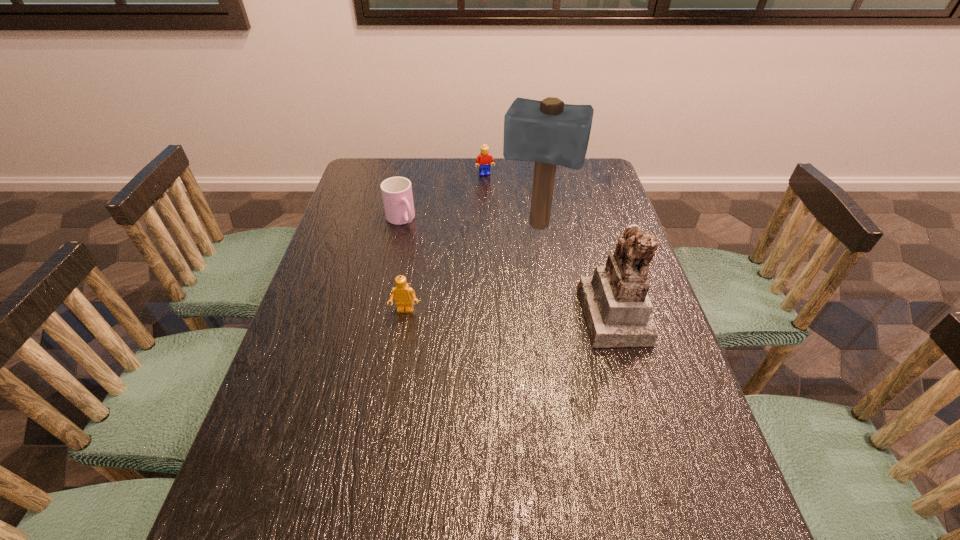
In order to click on empty space between the figurine and the cup in this screenshot , I will do `click(507, 267)`.

Locate an element on the screen. free area in between the cup and the mallet is located at coordinates (469, 223).

At what (x,y) coordinates should I click in order to perform the action: click on vacant space that's between the third object from left to right and the second tallest object. Please return your answer as a coordinate pair (x, y). Looking at the image, I should click on (549, 244).

Identify the location of free spot between the tallest object and the farther Lego. Image resolution: width=960 pixels, height=540 pixels. (512, 200).

The image size is (960, 540). Find the location of `free spot between the mallet and the farther Lego`. free spot between the mallet and the farther Lego is located at coordinates (512, 200).

Identify which object is located as the third nearest to the cup. Please provide its 2D coordinates. Your answer should be formatted as a tuple, i.e. [(x, y)], where the tuple contains the x and y coordinates of a point satisfying the conditions above.

[(403, 293)]

This screenshot has height=540, width=960. Find the location of `the second closest object to the figurine`. the second closest object to the figurine is located at coordinates (403, 293).

You are a GUI agent. You are given a task and a screenshot of the screen. Output one action in this format:
    pyautogui.click(x=<x>, y=<y>)
    Task: Click on the vacant space that satisfies the following two spatial constraints: 1. on the front side of the second tallest object; 2. on the front-facing side of the mallet
    This screenshot has width=960, height=540.
    Given the screenshot: What is the action you would take?
    pyautogui.click(x=551, y=314)

This screenshot has width=960, height=540. Find the location of `free space that satisfies the following two spatial constraints: 1. on the front side of the tallest object; 2. on the left side of the cup`. free space that satisfies the following two spatial constraints: 1. on the front side of the tallest object; 2. on the left side of the cup is located at coordinates (399, 226).

You are a GUI agent. You are given a task and a screenshot of the screen. Output one action in this format:
    pyautogui.click(x=<x>, y=<y>)
    Task: Click on the free spot that satisfies the following two spatial constraints: 1. on the face of the figurine; 2. on the front-facing side of the left Lego
    
    Given the screenshot: What is the action you would take?
    pyautogui.click(x=404, y=314)